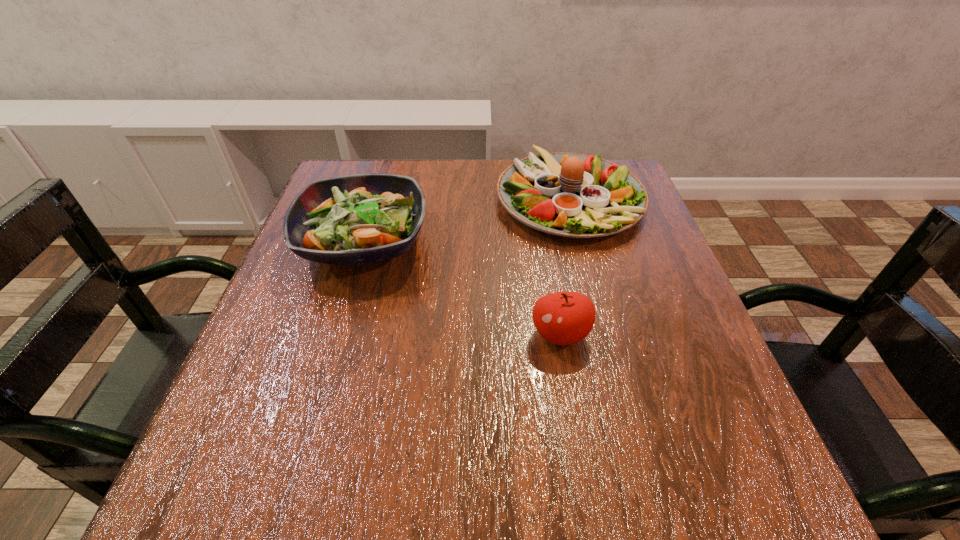
Locate an element on the screen. This screenshot has height=540, width=960. free space between the leftmost object and the right salad plate is located at coordinates (467, 220).

Identify the location of free space between the leftmost object and the nearest object. (462, 288).

Locate an element on the screen. The image size is (960, 540). vacant area between the apple and the left salad plate is located at coordinates (462, 288).

Image resolution: width=960 pixels, height=540 pixels. I want to click on vacant point located between the nearest object and the right salad plate, so click(x=564, y=267).

This screenshot has height=540, width=960. Find the location of `free space between the apple and the left salad plate`. free space between the apple and the left salad plate is located at coordinates (462, 288).

Identify the location of object that can be found as the closest to the left salad plate. This screenshot has width=960, height=540. (573, 195).

Identify which object is the second closest to the apple. Please provide its 2D coordinates. Your answer should be formatted as a tuple, i.e. [(x, y)], where the tuple contains the x and y coordinates of a point satisfying the conditions above.

[(354, 219)]